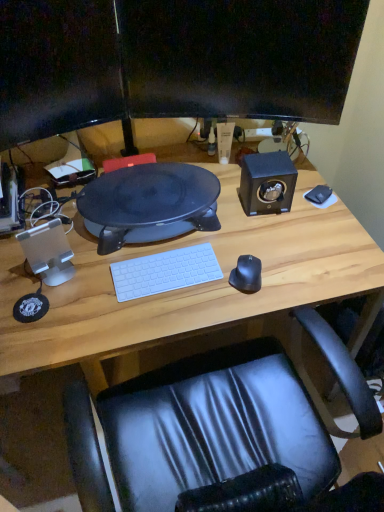
I want to click on free space behind black matte mouse at right, so click(x=244, y=244).